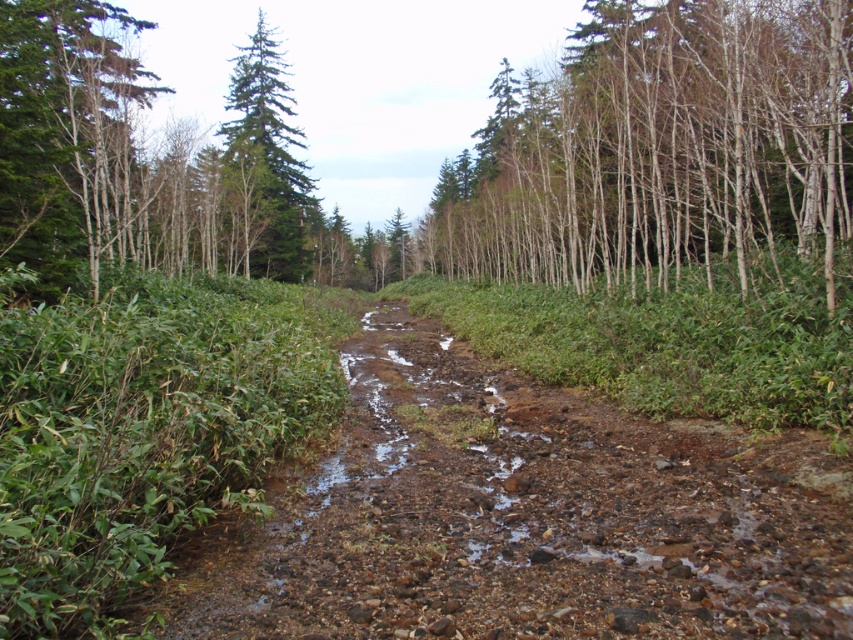
Question: Does bare wood trees at upper right have a greater width compared to green needle-like at upper center?

Choices:
 (A) yes
 (B) no

Answer: (B)

Question: Can you confirm if brown rocky dirt track at center is positioned above bare wood trees at upper right?

Choices:
 (A) yes
 (B) no

Answer: (B)

Question: Is bare wood trees at upper right further to the viewer compared to green needle-like at upper center?

Choices:
 (A) yes
 (B) no

Answer: (B)

Question: Which point is farther to the camera?

Choices:
 (A) (242, 100)
 (B) (459, 470)
 (C) (664, 26)

Answer: (A)

Question: Among these objects, which one is nearest to the camera?

Choices:
 (A) brown rocky dirt track at center
 (B) bare wood trees at upper right
 (C) green needle-like at upper center

Answer: (A)

Question: Estimate the real-world distances between objects in this image. Which object is farther from the bare wood trees at upper right?

Choices:
 (A) brown rocky dirt track at center
 (B) green needle-like at upper center

Answer: (A)